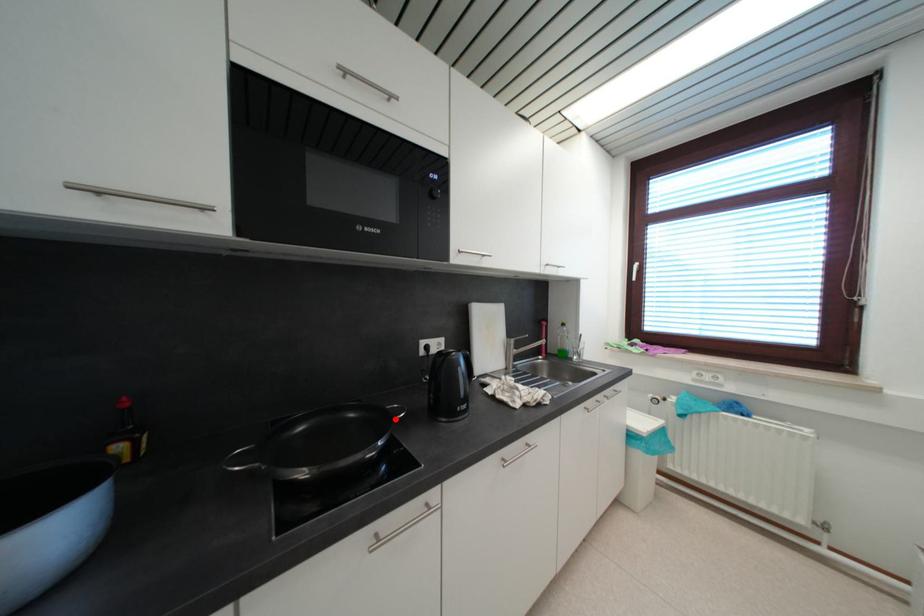
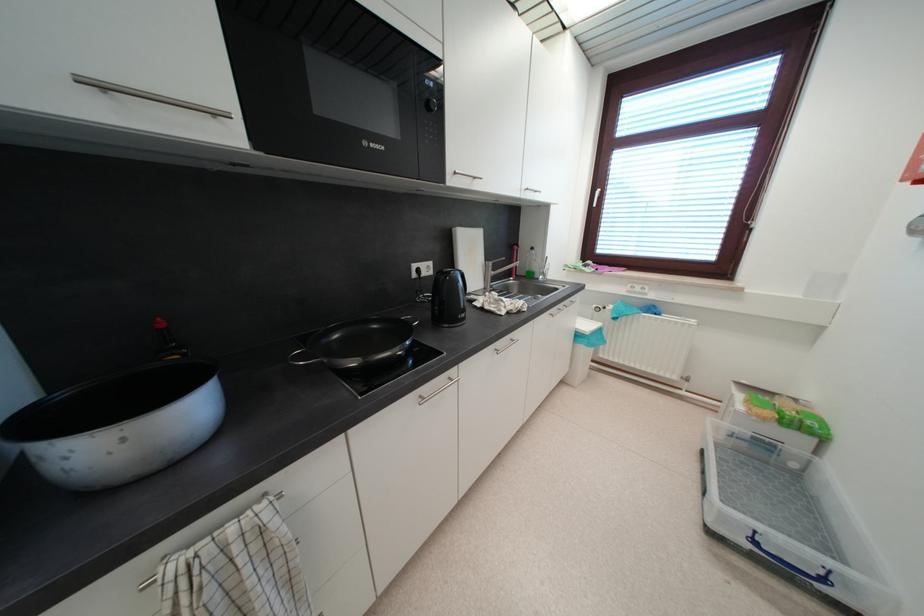
Where in the second image is the point corresponding to the highlighted location from the first image?

(412, 326)